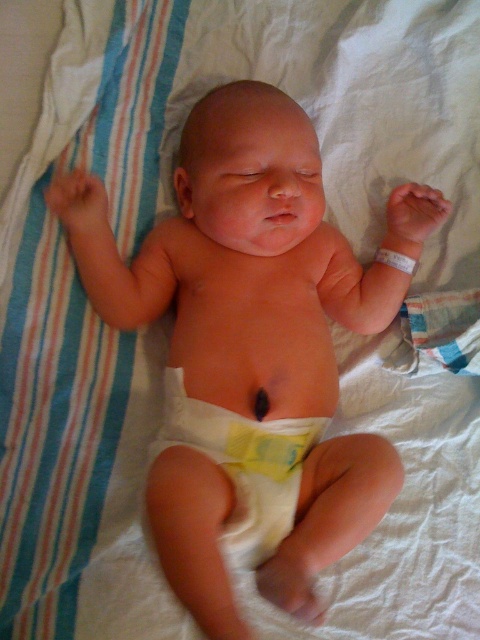
Question: Which point appears farthest from the camera in this image?

Choices:
 (A) (272, 493)
 (B) (232, 550)

Answer: (A)

Question: Which point is farther to the camera?

Choices:
 (A) (391, 221)
 (B) (273, 476)

Answer: (A)

Question: Does smooth skin baby at center have a smaller size compared to white cloth diaper at center?

Choices:
 (A) yes
 (B) no

Answer: (B)

Question: Does smooth skin baby at center come in front of white cloth diaper at center?

Choices:
 (A) no
 (B) yes

Answer: (B)

Question: Considering the relative positions of smooth skin baby at center and white cloth diaper at center in the image provided, where is smooth skin baby at center located with respect to white cloth diaper at center?

Choices:
 (A) below
 (B) above

Answer: (B)